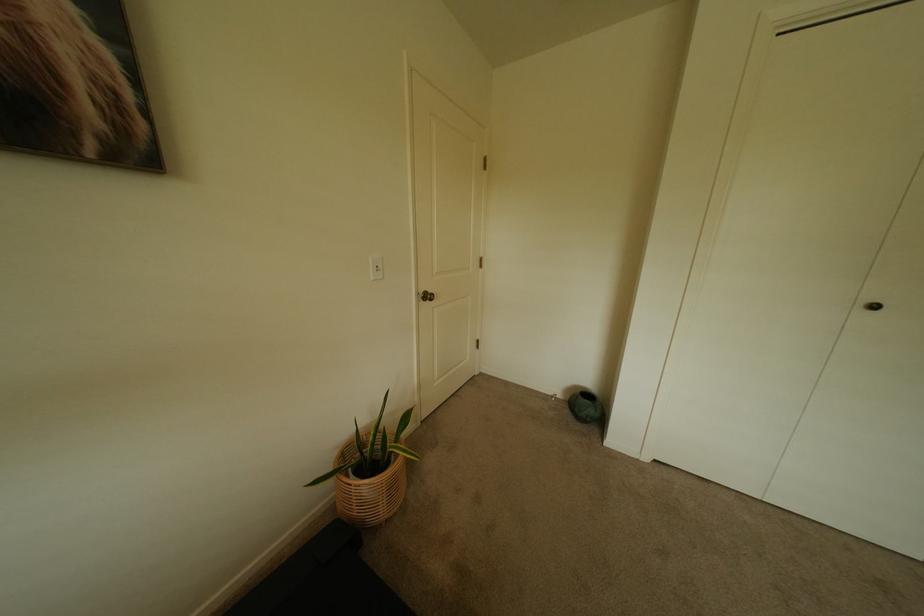
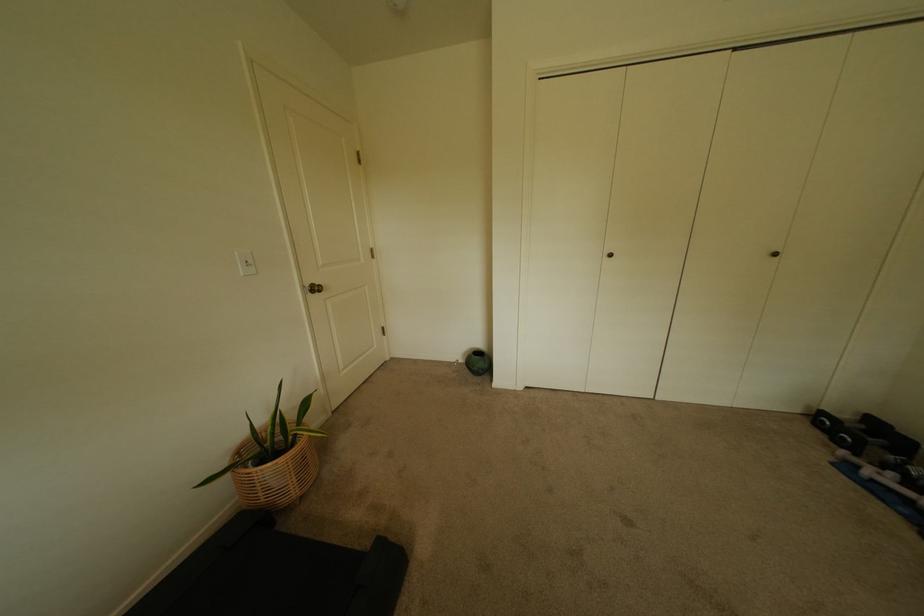
The point at (430,293) is marked in the first image. Where is the corresponding point in the second image?

(315, 286)